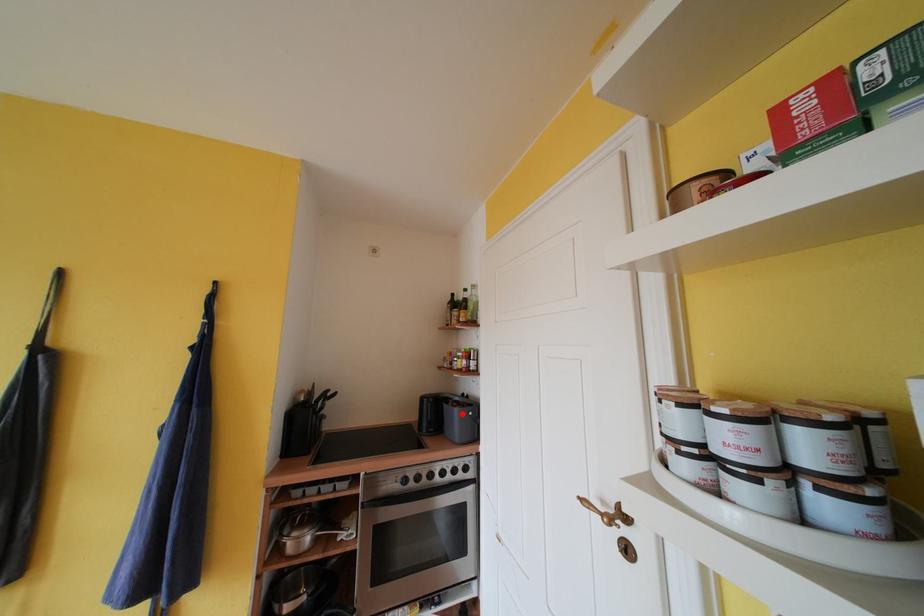
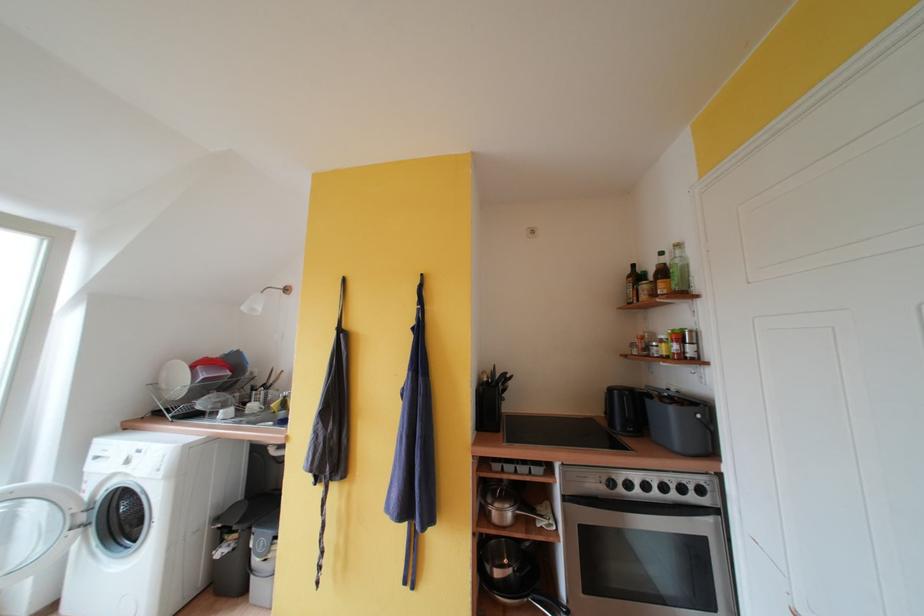
Locate, in the second image, the point that corresponds to the highlighted location in the first image.

(678, 413)